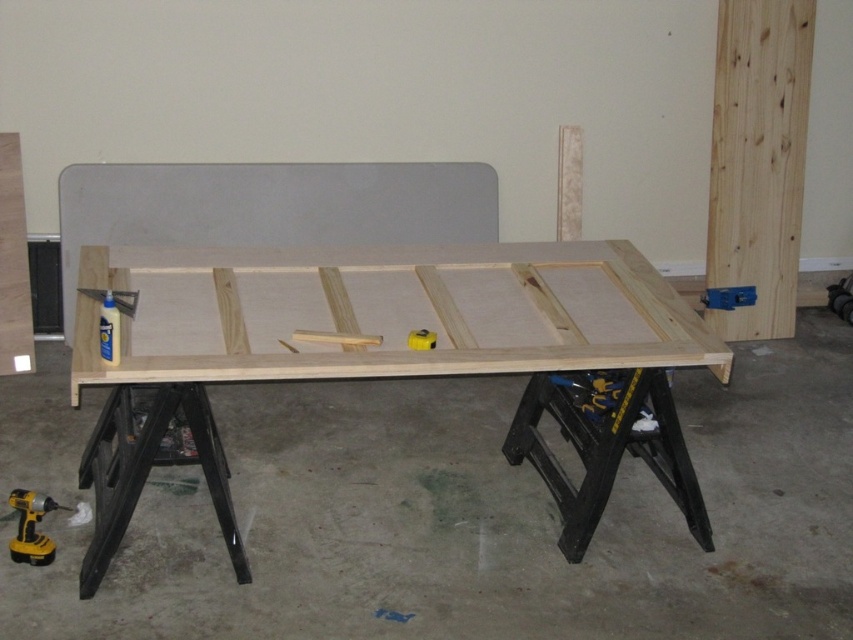
Does natural wood table at center appear on the left side of natural wood door at right?

Yes, natural wood table at center is to the left of natural wood door at right.

Can you confirm if natural wood table at center is positioned above natural wood door at right?

No, natural wood table at center is not above natural wood door at right.

Is point (659, 360) in front of point (795, 0)?

Yes, point (659, 360) is closer to viewer.

The width and height of the screenshot is (853, 640). Identify the location of natural wood table at center. (387, 355).

Between blue plastic clamp at center-right and yellow rubber at center, which one has less height?

With less height is yellow rubber at center.

Can you confirm if blue plastic clamp at center-right is shorter than yellow rubber at center?

No, blue plastic clamp at center-right is not shorter than yellow rubber at center.

Identify the location of blue plastic clamp at center-right. Image resolution: width=853 pixels, height=640 pixels. (728, 298).

Does natural wood door at right come behind blue plastic clamp at center-right?

No, it is in front of blue plastic clamp at center-right.

From the picture: Which is more to the left, natural wood door at right or blue plastic clamp at center-right?

blue plastic clamp at center-right is more to the left.

Does point (750, 17) lie behind point (732, 307)?

No, (750, 17) is closer to viewer.

I want to click on natural wood door at right, so click(x=758, y=161).